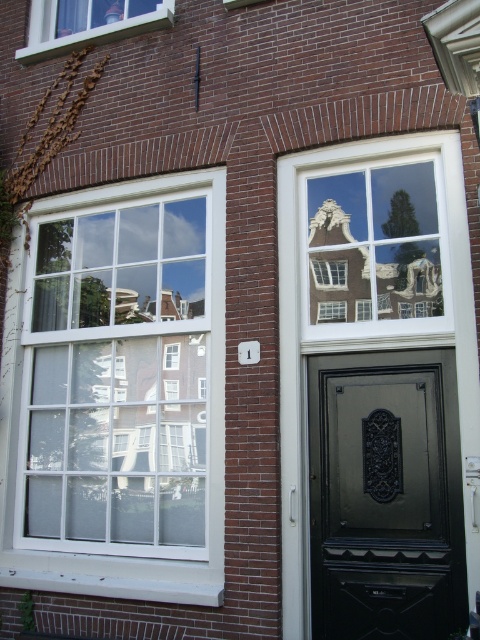
Question: Among these objects, which one is nearest to the camera?

Choices:
 (A) matte white window at upper left
 (B) matte black door at center
 (C) white glass window at upper left

Answer: (B)

Question: Based on their relative distances, which object is nearer to the matte white window at upper left?

Choices:
 (A) white glass window at upper left
 (B) matte black door at center

Answer: (A)

Question: Is matte black door at center wider than matte white window at upper left?

Choices:
 (A) no
 (B) yes

Answer: (A)

Question: Which point is closer to the camera taking this photo?

Choices:
 (A) (339, 522)
 (B) (152, 19)

Answer: (A)

Question: Is white glass window at upper left below matte white window at upper left?

Choices:
 (A) yes
 (B) no

Answer: (A)

Question: Is white glass window at upper left smaller than matte black door at center?

Choices:
 (A) yes
 (B) no

Answer: (B)